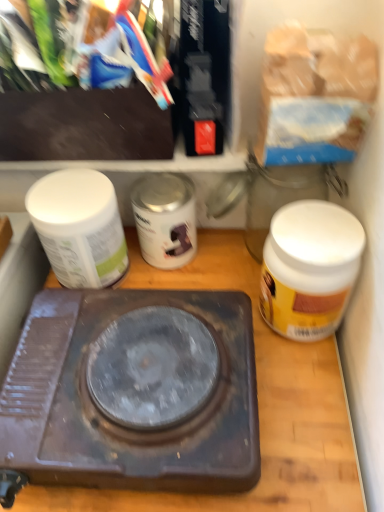
Question: Is brown matte/wooden counter top at center taller than white matte jar at right, which is counted as the 1th bottle, starting from the right?

Choices:
 (A) yes
 (B) no

Answer: (B)

Question: Is white matte jar at right, the third bottle when ordered from left to right, completely or partially inside brown matte/wooden counter top at center?

Choices:
 (A) yes
 (B) no

Answer: (B)

Question: From a real-world perspective, is brown matte/wooden counter top at center physically above white matte jar at right, which is counted as the 1th bottle, starting from the right?

Choices:
 (A) no
 (B) yes

Answer: (A)

Question: Is brown matte/wooden counter top at center thinner than white matte jar at right, which is counted as the 1th bottle, starting from the right?

Choices:
 (A) no
 (B) yes

Answer: (A)

Question: From a real-world perspective, is brown matte/wooden counter top at center positioned under white matte jar at right, the third bottle when ordered from left to right, based on gravity?

Choices:
 (A) yes
 (B) no

Answer: (A)

Question: Does brown matte/wooden counter top at center turn towards white matte jar at right, the third bottle when ordered from left to right?

Choices:
 (A) yes
 (B) no

Answer: (B)

Question: Does brown matte/wooden counter top at center turn towards white matte jar at left, the first bottle when ordered from left to right?

Choices:
 (A) yes
 (B) no

Answer: (B)

Question: Is brown matte/wooden counter top at center wider than white matte jar at left, which appears as the third bottle when viewed from the right?

Choices:
 (A) yes
 (B) no

Answer: (A)

Question: Can you see brown matte/wooden counter top at center touching white matte jar at left, the first bottle when ordered from left to right?

Choices:
 (A) yes
 (B) no

Answer: (B)

Question: Is brown matte/wooden counter top at center at the right side of white matte jar at left, the first bottle when ordered from left to right?

Choices:
 (A) no
 (B) yes

Answer: (B)

Question: Is brown matte/wooden counter top at center smaller than white matte jar at left, which appears as the third bottle when viewed from the right?

Choices:
 (A) no
 (B) yes

Answer: (A)

Question: From the image's perspective, is brown matte/wooden counter top at center located above white matte jar at left, which appears as the third bottle when viewed from the right?

Choices:
 (A) yes
 (B) no

Answer: (B)

Question: Does silver metallic can at center, the second bottle when ordered from left to right, have a lesser height compared to white matte jar at left, which appears as the third bottle when viewed from the right?

Choices:
 (A) yes
 (B) no

Answer: (A)